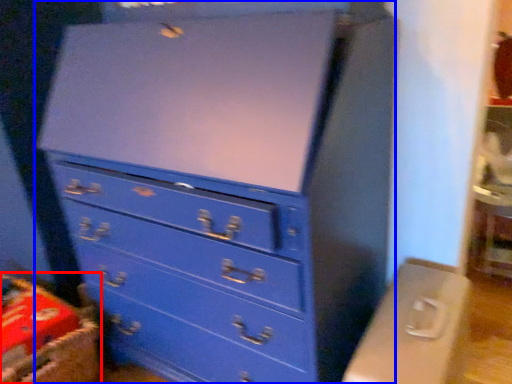
Question: Which point is further to the camera, crate (highlighted by a red box) or chest of drawers (highlighted by a blue box)?

Choices:
 (A) crate
 (B) chest of drawers

Answer: (A)